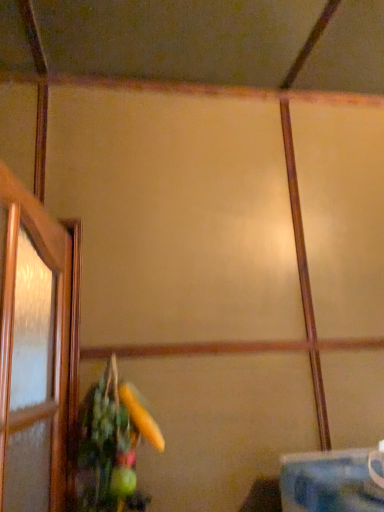
Question: Does green matte floral arrangement at lower left have a larger size compared to blue fabric table at lower right?

Choices:
 (A) no
 (B) yes

Answer: (B)

Question: From a real-world perspective, does green matte floral arrangement at lower left sit lower than blue fabric table at lower right?

Choices:
 (A) no
 (B) yes

Answer: (A)

Question: From the image's perspective, is green matte floral arrangement at lower left beneath blue fabric table at lower right?

Choices:
 (A) no
 (B) yes

Answer: (A)

Question: Is the position of green matte floral arrangement at lower left more distant than that of blue fabric table at lower right?

Choices:
 (A) yes
 (B) no

Answer: (A)

Question: Can you confirm if green matte floral arrangement at lower left is thinner than blue fabric table at lower right?

Choices:
 (A) no
 (B) yes

Answer: (B)

Question: Considering the relative sizes of green matte floral arrangement at lower left and blue fabric table at lower right in the image provided, is green matte floral arrangement at lower left wider than blue fabric table at lower right?

Choices:
 (A) no
 (B) yes

Answer: (A)

Question: Is blue fabric table at lower right turned away from green matte floral arrangement at lower left?

Choices:
 (A) no
 (B) yes

Answer: (A)

Question: Does blue fabric table at lower right come behind green matte floral arrangement at lower left?

Choices:
 (A) no
 (B) yes

Answer: (A)

Question: Can you confirm if blue fabric table at lower right is smaller than green matte floral arrangement at lower left?

Choices:
 (A) yes
 (B) no

Answer: (A)

Question: Considering the relative sizes of blue fabric table at lower right and green matte floral arrangement at lower left in the image provided, is blue fabric table at lower right shorter than green matte floral arrangement at lower left?

Choices:
 (A) no
 (B) yes

Answer: (B)

Question: Can you confirm if blue fabric table at lower right is bigger than green matte floral arrangement at lower left?

Choices:
 (A) yes
 (B) no

Answer: (B)

Question: Considering the relative positions of blue fabric table at lower right and green matte floral arrangement at lower left in the image provided, is blue fabric table at lower right to the right of green matte floral arrangement at lower left from the viewer's perspective?

Choices:
 (A) yes
 (B) no

Answer: (A)

Question: Is green matte floral arrangement at lower left inside or outside of blue fabric table at lower right?

Choices:
 (A) outside
 (B) inside

Answer: (A)